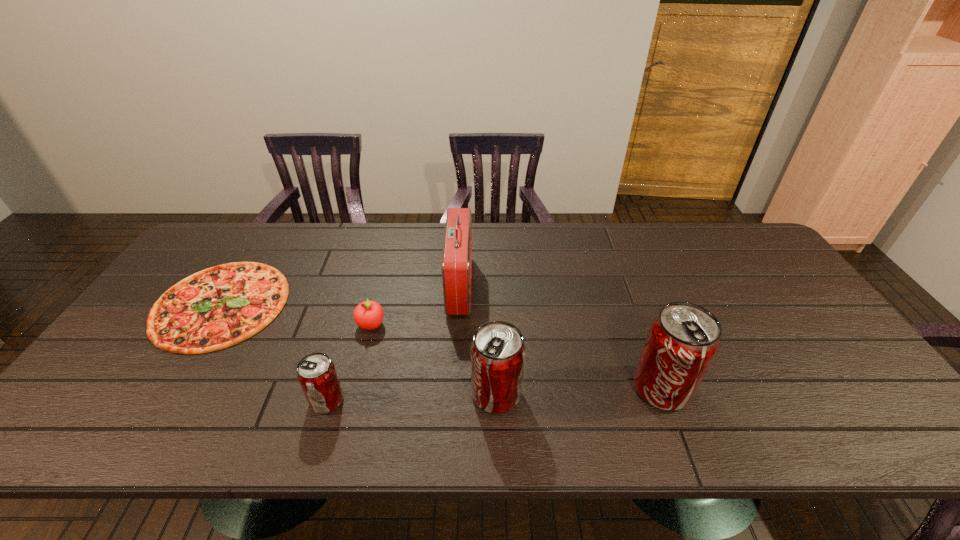
The height and width of the screenshot is (540, 960). In order to click on free space between the shortest pop soda and the third object from right to left in this screenshot , I will do `click(394, 343)`.

Find the location of a particular element. object that is the closest to the fourth tallest object is located at coordinates click(x=368, y=315).

Choose which object is the fourth nearest neighbor to the shortest object. Please provide its 2D coordinates. Your answer should be formatted as a tuple, i.e. [(x, y)], where the tuple contains the x and y coordinates of a point satisfying the conditions above.

[(497, 351)]

Where is `pop soda object that ranks as the closest to the third tallest object`? Image resolution: width=960 pixels, height=540 pixels. pop soda object that ranks as the closest to the third tallest object is located at coordinates (683, 339).

Identify which pop soda is the closest to the shortest object. Please provide its 2D coordinates. Your answer should be formatted as a tuple, i.e. [(x, y)], where the tuple contains the x and y coordinates of a point satisfying the conditions above.

[(316, 373)]

Where is `free point that satisfies the following two spatial constraints: 1. on the back side of the second tallest pop soda; 2. on the side of the first-aid kit with the first aid cross symbol`? The width and height of the screenshot is (960, 540). free point that satisfies the following two spatial constraints: 1. on the back side of the second tallest pop soda; 2. on the side of the first-aid kit with the first aid cross symbol is located at coordinates [492, 286].

Image resolution: width=960 pixels, height=540 pixels. In order to click on free space that satisfies the following two spatial constraints: 1. on the front side of the rightmost object; 2. on the left side of the second shortest object in this screenshot , I will do `click(355, 388)`.

I want to click on vacant area that satisfies the following two spatial constraints: 1. on the side of the rightmost pop soda with the first aid cross symbol; 2. on the left side of the third object from right to left, so click(x=454, y=388).

What are the coordinates of `free space that satisfies the following two spatial constraints: 1. on the back side of the second object from right to left; 2. on the side of the first-aid kit with the first aid cross symbol` in the screenshot? It's located at (492, 286).

Find the location of a particular element. This screenshot has height=540, width=960. vacant space that satisfies the following two spatial constraints: 1. on the back side of the apple; 2. on the left side of the shortest pop soda is located at coordinates (x=349, y=325).